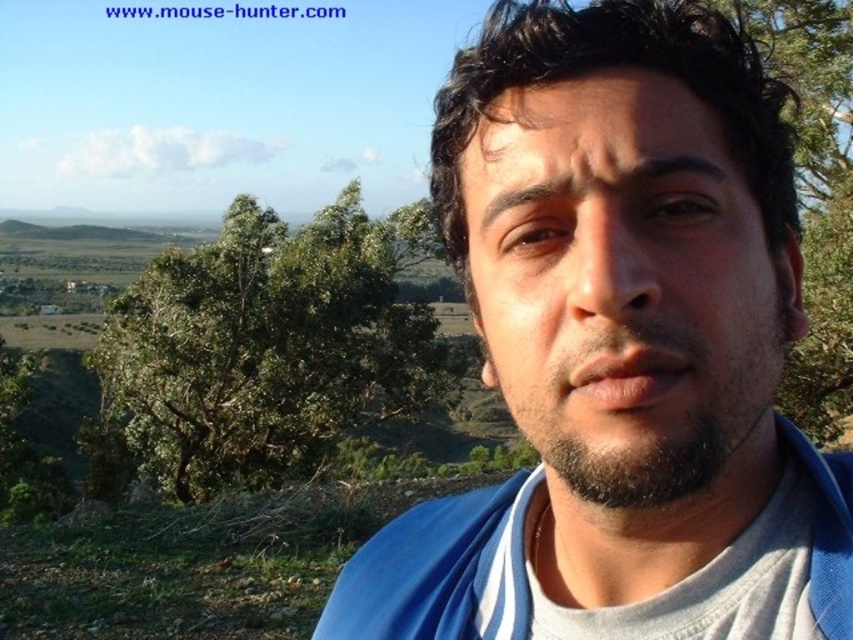
Question: Does blue fabric shirt at center lie in front of green leafy tree at upper left?

Choices:
 (A) no
 (B) yes

Answer: (B)

Question: Does blue fabric shirt at center have a larger size compared to green leafy tree at upper left?

Choices:
 (A) yes
 (B) no

Answer: (B)

Question: Among these objects, which one is nearest to the camera?

Choices:
 (A) green leafy tree at upper left
 (B) blue fabric shirt at center

Answer: (B)

Question: Which point appears closest to the camera in this image?

Choices:
 (A) (364, 250)
 (B) (587, 141)

Answer: (B)

Question: Is blue fabric shirt at center smaller than green leafy tree at upper left?

Choices:
 (A) no
 (B) yes

Answer: (B)